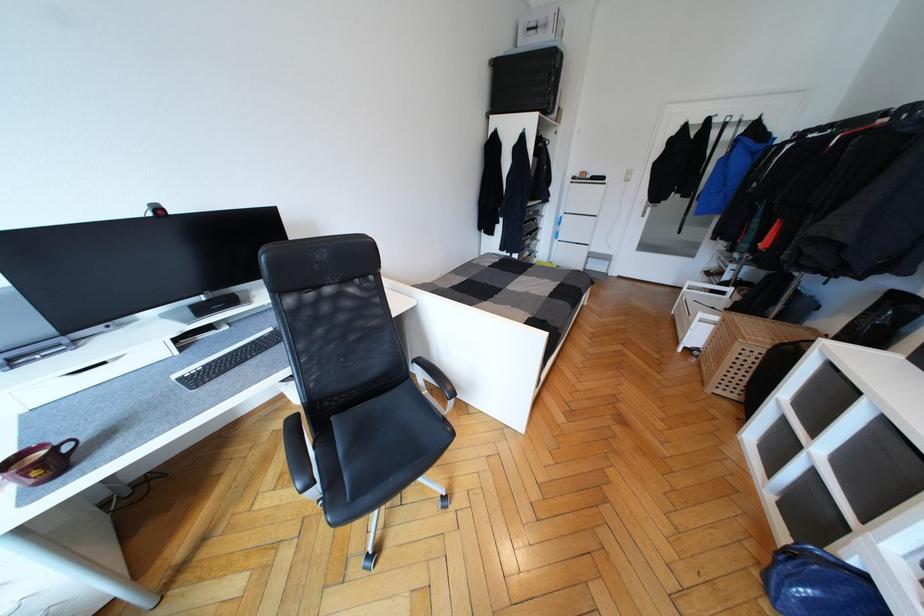
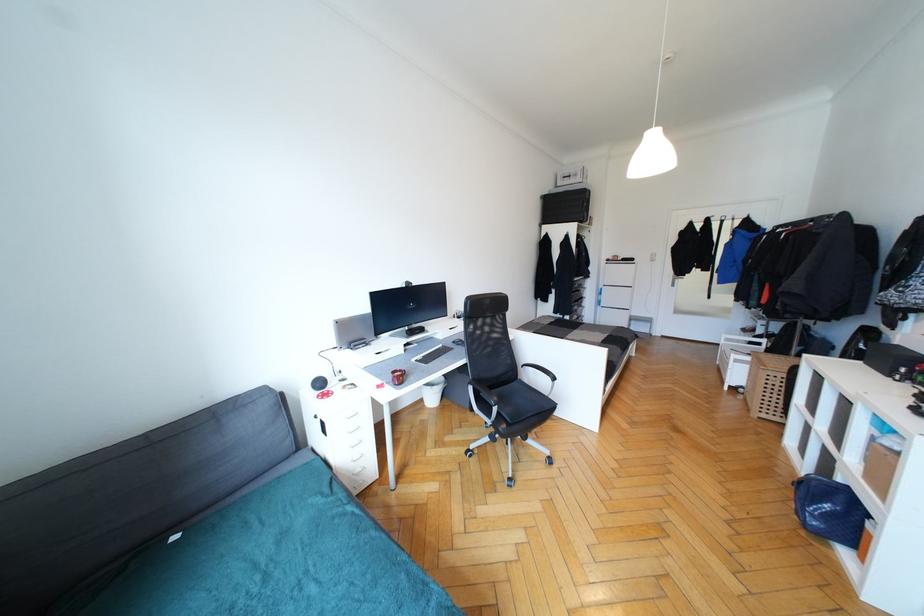
The images are taken continuously from a first-person perspective. In which direction are you moving?

The cameraman moved toward left, backward.